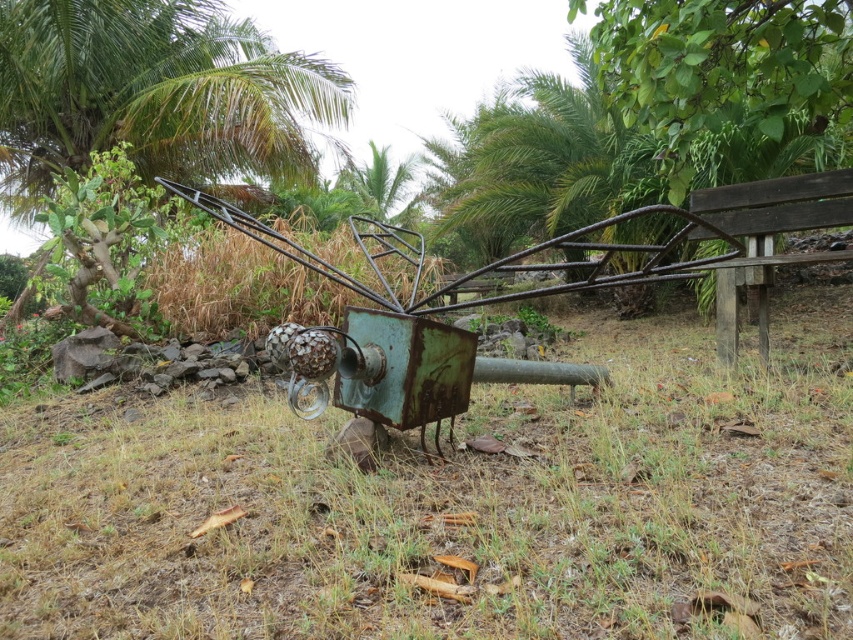
Can you confirm if green grass at center is positioned to the right of green leafy palm tree at upper center?

Indeed, green grass at center is positioned on the right side of green leafy palm tree at upper center.

Between point (157, 515) and point (379, 195), which one is positioned in front?

Point (157, 515)

I want to click on green grass at center, so click(x=451, y=502).

Between green wood bench at right and dark brown wooden bench at right, which one has more height?

green wood bench at right is taller.

Who is more forward, (790, 20) or (809, 253)?

Point (790, 20) is in front.

This screenshot has height=640, width=853. Identify the location of green wood bench at right. (722, 67).

Locate an element on the screen. green wood bench at right is located at coordinates (722, 67).

Which of these two, green leafy palm tree at upper left or green wood bench at right, stands taller?

Standing taller between the two is green leafy palm tree at upper left.

Is the position of green leafy palm tree at upper left less distant than that of green wood bench at right?

No.

Identify the location of green leafy palm tree at upper left. The width and height of the screenshot is (853, 640). (154, 93).